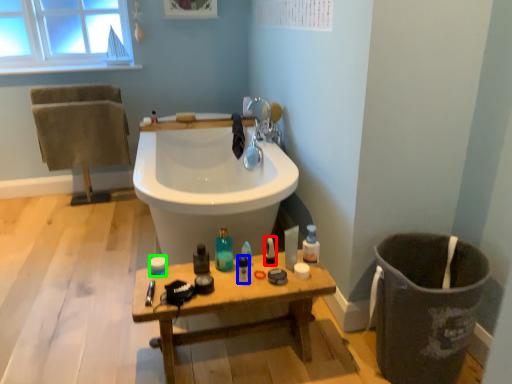
Question: Which is nearer to the cleaning product (highlighted by a red box)? mouthwash (highlighted by a blue box) or toiletry (highlighted by a green box).

Choices:
 (A) mouthwash
 (B) toiletry

Answer: (A)